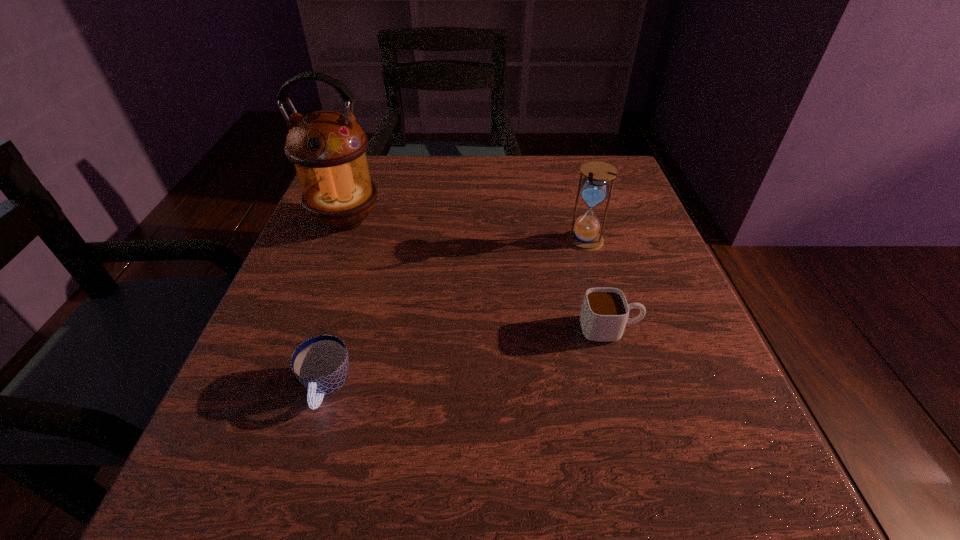
Locate an element on the screen. The width and height of the screenshot is (960, 540). vacant space at the near right corner of the desktop is located at coordinates (746, 460).

This screenshot has width=960, height=540. Find the location of `vacant region between the hourglass and the nearest object`. vacant region between the hourglass and the nearest object is located at coordinates (456, 315).

This screenshot has width=960, height=540. What are the coordinates of `vacant area that lies between the nearer cup and the oil lamp` in the screenshot? It's located at (336, 305).

Where is `unoccupied position between the nearest object and the hourglass`? This screenshot has height=540, width=960. unoccupied position between the nearest object and the hourglass is located at coordinates (456, 315).

This screenshot has height=540, width=960. Identify the location of empty location between the second tallest object and the nearest object. (456, 315).

Locate an element on the screen. The width and height of the screenshot is (960, 540). vacant area that lies between the left cup and the tallest object is located at coordinates (336, 305).

Image resolution: width=960 pixels, height=540 pixels. In order to click on free space between the oil lamp and the second nearest object in this screenshot , I will do `click(478, 275)`.

I want to click on free space between the second tallest object and the oil lamp, so click(x=466, y=231).

I want to click on free space between the oil lamp and the third shortest object, so click(x=466, y=231).

The height and width of the screenshot is (540, 960). Find the location of `unoccupied area between the second tallest object and the farther cup`. unoccupied area between the second tallest object and the farther cup is located at coordinates (597, 285).